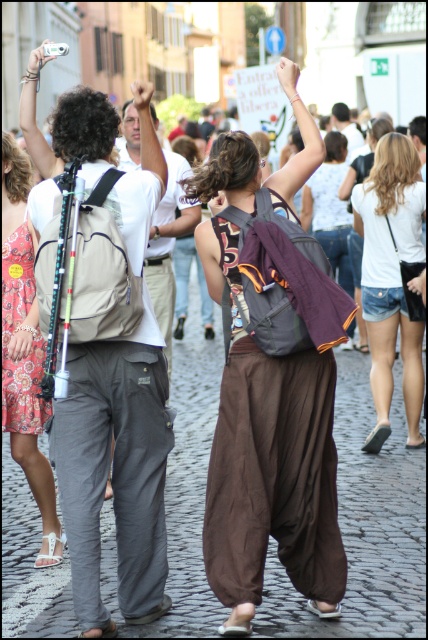
Question: Does matte gray pants at center appear over matte purple backpack at center?

Choices:
 (A) no
 (B) yes

Answer: (A)

Question: Which object is positioned farthest from the matte gray pants at center?

Choices:
 (A) smooth skin hand at center
 (B) floral print dress at center

Answer: (A)

Question: Which of the following is the closest to the observer?

Choices:
 (A) (273, 173)
 (B) (133, 227)

Answer: (B)

Question: Does matte gray pants at center have a larger size compared to smooth skin hand at upper center?

Choices:
 (A) yes
 (B) no

Answer: (B)

Question: Can you confirm if floral print dress at center is positioned to the left of light brown leather jacket at upper center?

Choices:
 (A) yes
 (B) no

Answer: (A)

Question: Which of the following is the closest to the observer?

Choices:
 (A) (20, 170)
 (B) (115, 468)
 (C) (323, 602)
 (D) (296, 93)

Answer: (C)